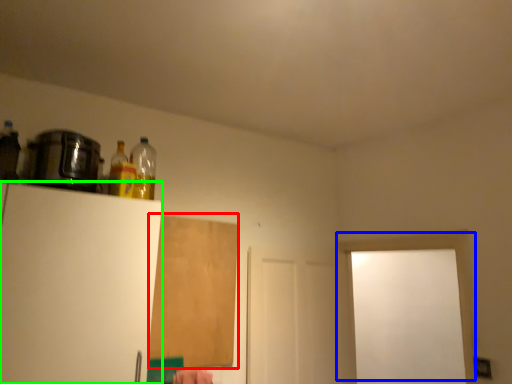
Question: Based on their relative distances, which object is farther from plywood (highlighted by a red box)? Choose from door (highlighted by a blue box) and appliance (highlighted by a green box).

Choices:
 (A) door
 (B) appliance

Answer: (A)